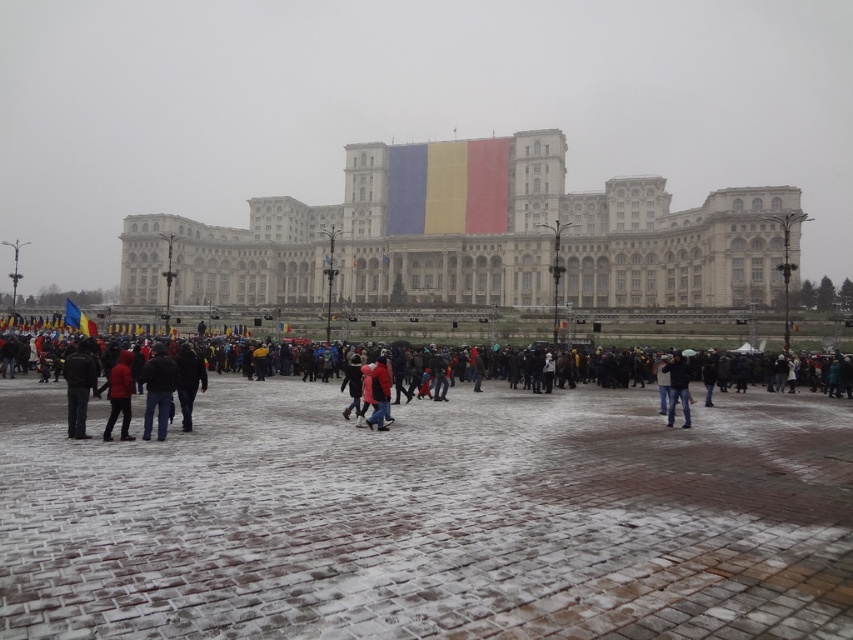
Question: Among these points, which one is nearest to the camera?

Choices:
 (A) (206, 378)
 (B) (677, 371)
 (C) (154, 360)
 (D) (471, 234)

Answer: (C)

Question: Does dark gray pants at lower left have a larger size compared to jeans at center?

Choices:
 (A) no
 (B) yes

Answer: (B)

Question: Which object appears closest to the camera in this image?

Choices:
 (A) dark blue jeans at center
 (B) dark gray pants at lower left
 (C) jeans at center
 (D) dark gray jacket at center

Answer: (B)

Question: Estimate the real-world distances between objects in this image. Which object is farther from the dark blue jeans at center?

Choices:
 (A) white stone building at center
 (B) red matte jacket at center
 (C) dark gray jacket at center
 (D) jeans at center

Answer: (A)

Question: Where is snowy cobblestone plaza at center located in relation to dark gray pants at lower left in the image?

Choices:
 (A) right
 (B) left

Answer: (A)

Question: Is snowy cobblestone plaza at center to the left of dark gray pants at lower left from the viewer's perspective?

Choices:
 (A) no
 (B) yes

Answer: (A)